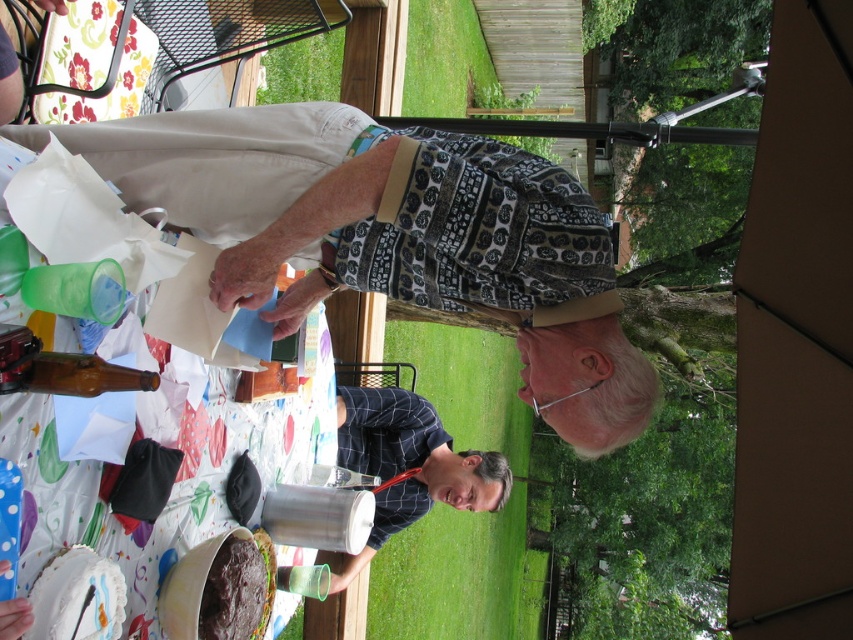
Can you confirm if brown fabric canopy at upper right is thinner than chocolate cake at lower center?

No, brown fabric canopy at upper right is not thinner than chocolate cake at lower center.

Can you confirm if brown fabric canopy at upper right is positioned below chocolate cake at lower center?

Actually, brown fabric canopy at upper right is above chocolate cake at lower center.

Does point (740, 342) lie in front of point (207, 616)?

No, (740, 342) is behind (207, 616).

You are a GUI agent. You are given a task and a screenshot of the screen. Output one action in this format:
    pyautogui.click(x=<x>, y=<y>)
    Task: Click on the brown fabric canopy at upper right
    The height and width of the screenshot is (640, 853).
    Given the screenshot: What is the action you would take?
    pyautogui.click(x=796, y=340)

Who is lower down, dark blue plaid shirt at center or chocolate cake at lower center?

dark blue plaid shirt at center is lower down.

Is dark blue plaid shirt at center closer to the viewer compared to chocolate cake at lower center?

No, it is behind chocolate cake at lower center.

Does point (477, 474) come in front of point (212, 616)?

No, (477, 474) is behind (212, 616).

I want to click on dark blue plaid shirt at center, so click(x=409, y=465).

Based on the photo, does brown fabric canopy at upper right have a greater width compared to dark blue plaid shirt at center?

Incorrect, brown fabric canopy at upper right's width does not surpass dark blue plaid shirt at center's.

Where is `brown fabric canopy at upper right`? This screenshot has height=640, width=853. brown fabric canopy at upper right is located at coordinates (796, 340).

Is point (780, 221) farther from viewer compared to point (352, 467)?

No, it is in front of (352, 467).

At what (x,y) coordinates should I click in order to perform the action: click on brown fabric canopy at upper right. Please return your answer as a coordinate pair (x, y). This screenshot has height=640, width=853. Looking at the image, I should click on (796, 340).